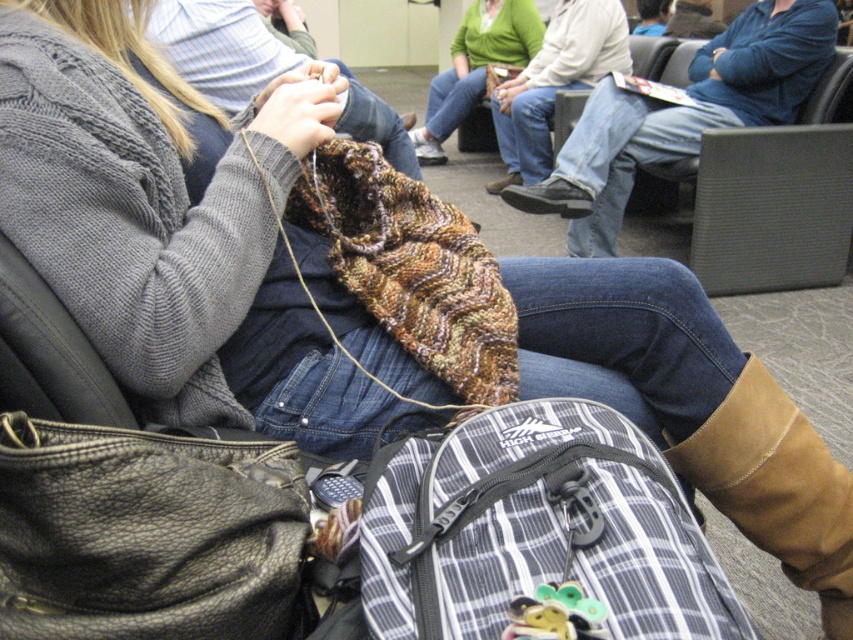
Question: Is blue jeans at center to the left of jeans at center from the viewer's perspective?

Choices:
 (A) no
 (B) yes

Answer: (A)

Question: Based on their relative distances, which object is farther from the brown leather boot at lower right?

Choices:
 (A) black leather bag at lower left
 (B) blue jeans at center
 (C) jeans at center
 (D) green knitted sweater at center

Answer: (D)

Question: Can you confirm if blue jeans at center is thinner than jeans at center?

Choices:
 (A) no
 (B) yes

Answer: (A)

Question: Estimate the real-world distances between objects in this image. Which object is farther from the black leather bag at lower left?

Choices:
 (A) brown leather boot at lower right
 (B) green knitted sweater at center
 (C) jeans at center

Answer: (B)

Question: Which object is the farthest from the black leather bag at lower left?

Choices:
 (A) brown leather boot at lower right
 (B) green knitted sweater at center

Answer: (B)

Question: Can you confirm if brown leather boot at lower right is smaller than jeans at center?

Choices:
 (A) no
 (B) yes

Answer: (B)